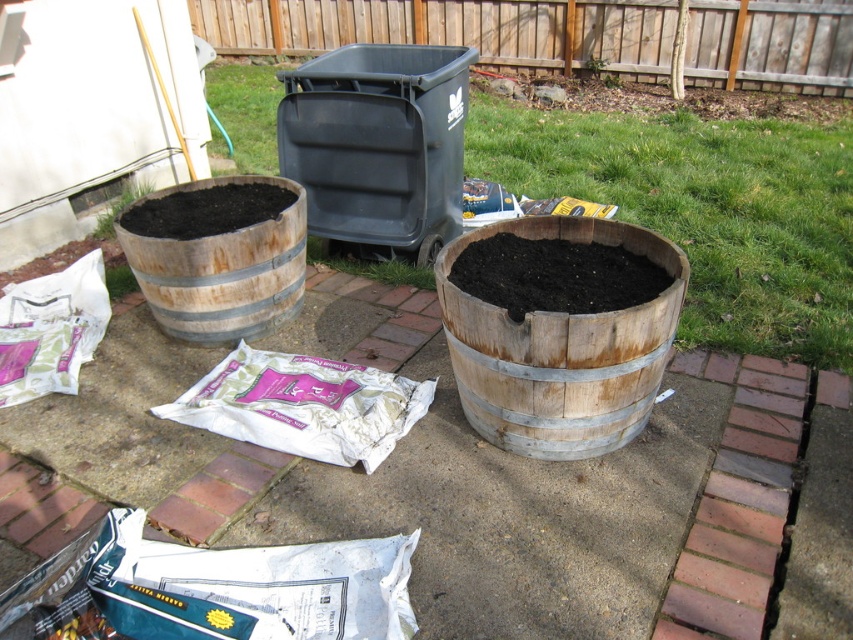
You are a gardener who wants to plant a new green leafy plant at upper center into the wooden barrel at center. Can the plant fit inside the barrel based on their heights?

The wooden barrel at center is taller than the green leafy plant at upper center, so the plant can fit inside the barrel.

You are a gardener who needs to plant the green leafy plant at upper center into the brown wooden barrel at center. Can you do this without moving the barrel or the plant?

The brown wooden barrel at center is in front of the green leafy plant at upper center, so you can plant the green leafy plant at upper center into the brown wooden barrel at center without needing to move either since they are positioned in a way that allows access.

You are a gardener who wants to plant the green leafy plant at upper center into the wooden barrel at center. Considering their sizes, will the plant fit comfortably in the barrel?

The wooden barrel at center is larger in size than the green leafy plant at upper center, so the plant should fit comfortably in the barrel.